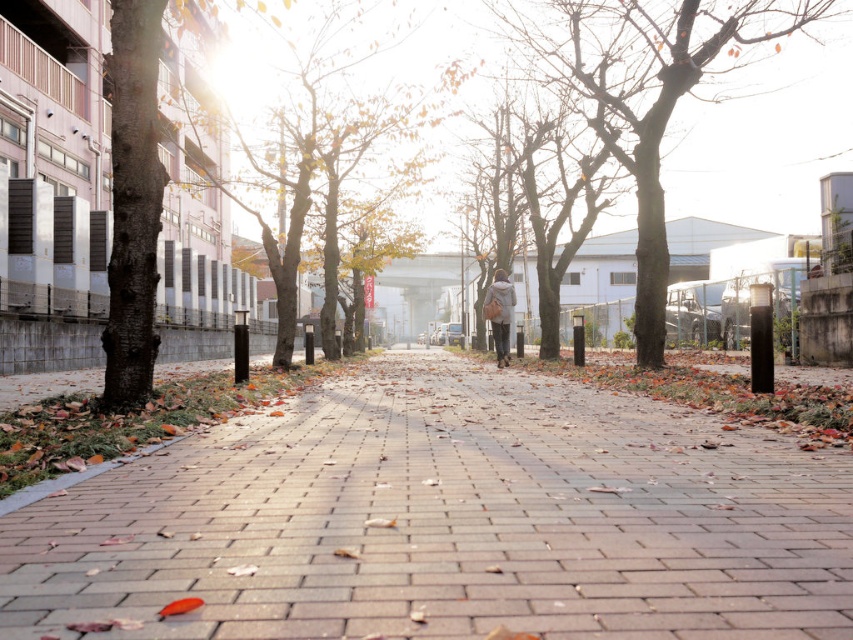
Looking at this image, you are a pedestrian walking along the brick pavement at center and notice a bare wood tree at center nearby. Which direction should you turn to face the tree?

The brick pavement at center is to the left of the bare wood tree at center, so you should turn to your right to face the tree.